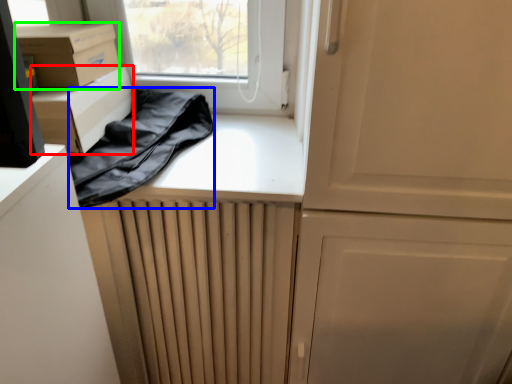
Question: Which object is the closest to the cardboard box (highlighted by a red box)? Choose among these: clothing (highlighted by a blue box) or cardboard box (highlighted by a green box).

Choices:
 (A) clothing
 (B) cardboard box

Answer: (B)